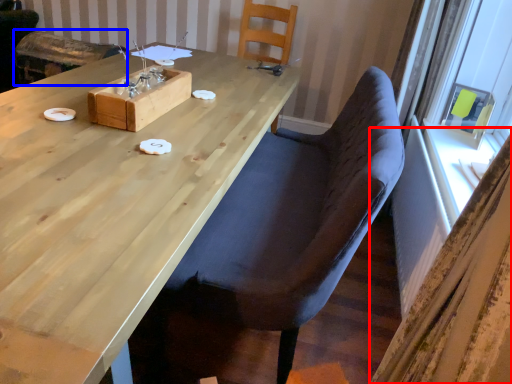
Question: Which object appears closest to the camera in this image, curtain (highlighted by a red box) or armchair (highlighted by a blue box)?

Choices:
 (A) curtain
 (B) armchair

Answer: (A)